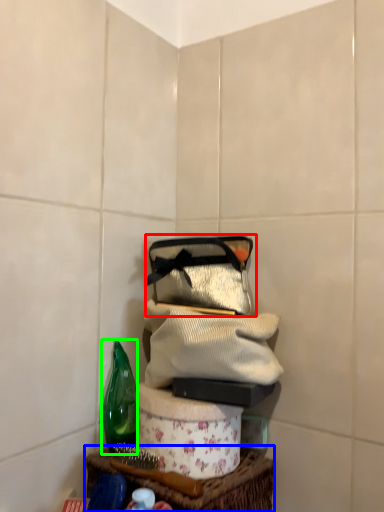
Question: Based on their relative distances, which object is farther from handbag (highlighted by a red box)? Choose from table (highlighted by a blue box) and bottle (highlighted by a green box).

Choices:
 (A) table
 (B) bottle

Answer: (A)